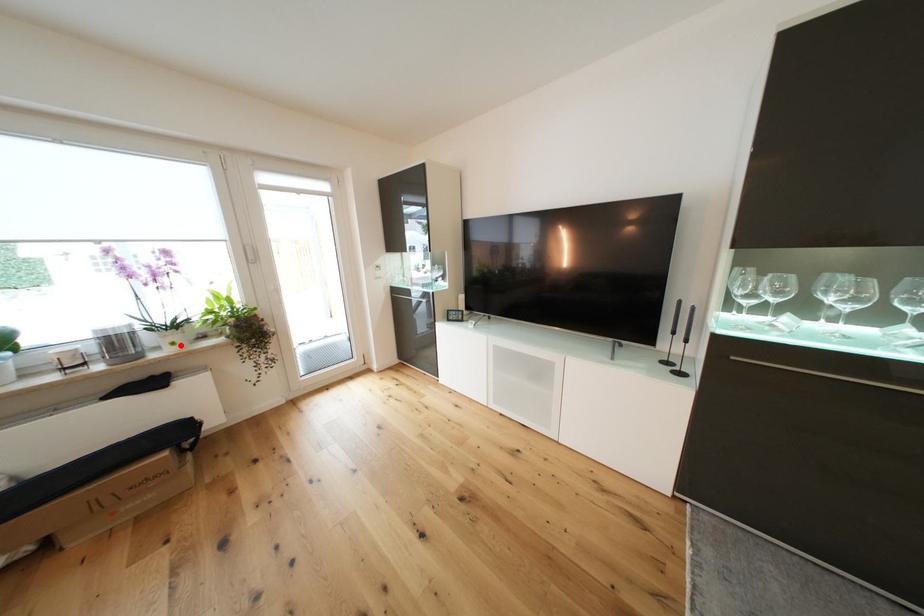
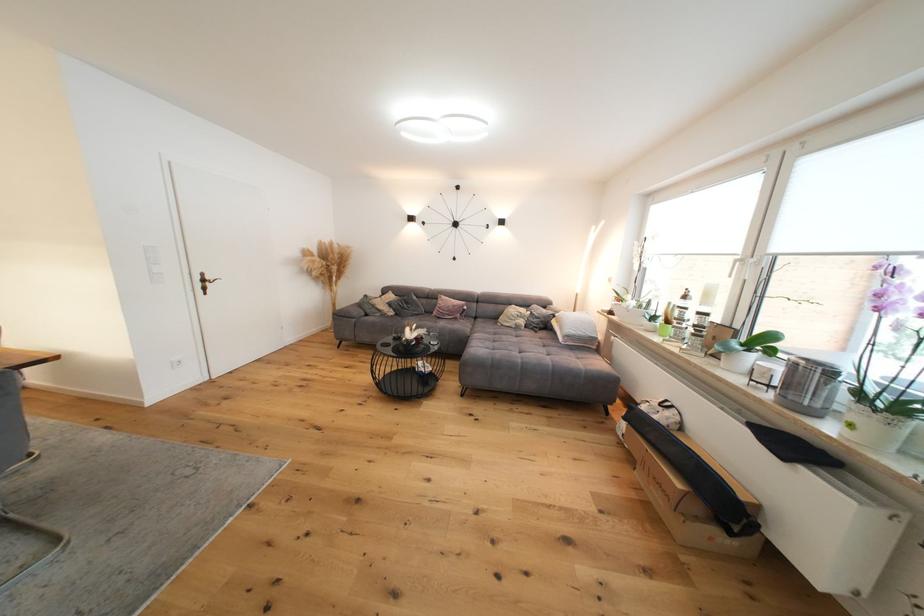
Question: I am providing you with two images of the same scene from different viewpoints. Given a red point in image1, look at the same physical point in image2. Is it:

Choices:
 (A) Closer to the viewpoint
 (B) Farther from the viewpoint

Answer: (B)